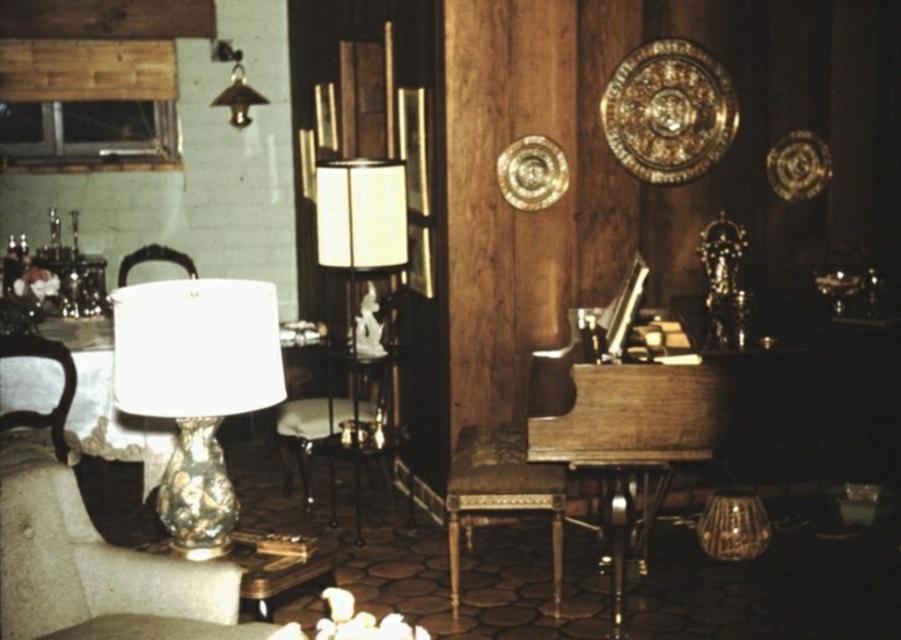
Can you confirm if matte glass lamp at center is smaller than wooden armchair at left?

Incorrect, matte glass lamp at center is not smaller in size than wooden armchair at left.

You are a GUI agent. You are given a task and a screenshot of the screen. Output one action in this format:
    pyautogui.click(x=<x>, y=<y>)
    Task: Click on the matte glass lamp at center
    The height and width of the screenshot is (640, 901).
    Given the screenshot: What is the action you would take?
    pyautogui.click(x=360, y=212)

Who is more forward, (367, 220) or (19, 420)?

Positioned in front is point (367, 220).

The image size is (901, 640). Identify the location of matte glass lamp at center. (360, 212).

Between white lace tablecloth at left and brown leather stool at center, which one has more height?

white lace tablecloth at left

This screenshot has height=640, width=901. Describe the element at coordinates (106, 403) in the screenshot. I see `white lace tablecloth at left` at that location.

Who is more forward, (26, 401) or (458, 598)?

Point (458, 598)

You are a GUI agent. You are given a task and a screenshot of the screen. Output one action in this format:
    pyautogui.click(x=<x>, y=<y>)
    Task: Click on the white lace tablecloth at left
    The height and width of the screenshot is (640, 901).
    Given the screenshot: What is the action you would take?
    pyautogui.click(x=106, y=403)

Which is above, gold-patterned glass lamp at left or matte glass lamp at center?

matte glass lamp at center is above.

Is point (160, 497) positioned before point (326, 209)?

That is True.

Does point (217, 298) come closer to viewer compared to point (387, 205)?

Yes, point (217, 298) is closer to viewer.

Identify the location of gold-patterned glass lamp at left. This screenshot has height=640, width=901. (196, 387).